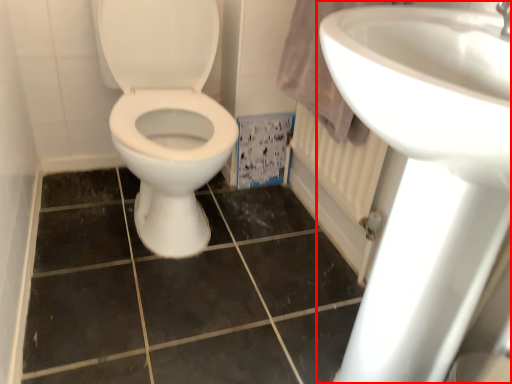
Question: From the image's perspective, considering the relative positions of sink (annotated by the red box) and ceramic tile in the image provided, where is sink (annotated by the red box) located with respect to the staircase?

Choices:
 (A) above
 (B) below

Answer: (A)